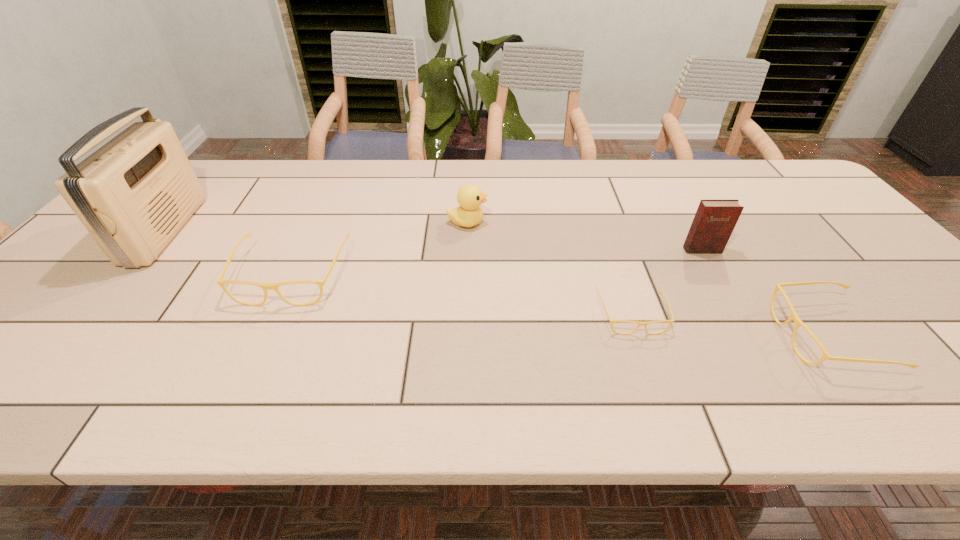
You are a GUI agent. You are given a task and a screenshot of the screen. Output one action in this format:
    pyautogui.click(x=<x>, y=<y>)
    Task: Click on the free spot between the fourth object from right to left and the second spectacles from right to left
    The image size is (960, 540).
    Given the screenshot: What is the action you would take?
    pyautogui.click(x=549, y=268)

This screenshot has height=540, width=960. I want to click on free space between the leftmost object and the second shortest spectacles, so click(496, 284).

Locate an element on the screen. The image size is (960, 540). free space between the fifth shortest object and the radio receiver is located at coordinates (434, 240).

At what (x,y) coordinates should I click in order to perform the action: click on free space that is in between the second object from right to left and the shortest spectacles. Please return your answer as a coordinate pair (x, y). This screenshot has height=540, width=960. Looking at the image, I should click on (667, 282).

In order to click on object that is the closest to the rightmost spectacles in this screenshot , I will do `click(714, 221)`.

Point out which object is positioned as the third nearest to the third object from right to left. Please provide its 2D coordinates. Your answer should be formatted as a tuple, i.e. [(x, y)], where the tuple contains the x and y coordinates of a point satisfying the conditions above.

[(470, 197)]

At what (x,y) coordinates should I click in order to perform the action: click on spectacles that is the closest to the fourth object from left to right. Please return your answer as a coordinate pair (x, y). The width and height of the screenshot is (960, 540). Looking at the image, I should click on pyautogui.click(x=794, y=317).

Locate which spectacles is the second closest to the fifth object from right to left. Please provide its 2D coordinates. Your answer should be formatted as a tuple, i.e. [(x, y)], where the tuple contains the x and y coordinates of a point satisfying the conditions above.

[(794, 317)]